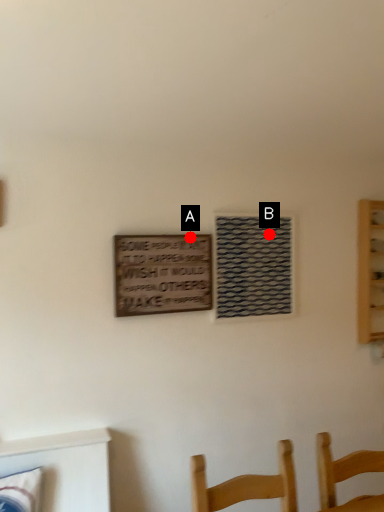
Question: Two points are circled on the image, labeled by A and B beside each circle. Which point is closer to the camera?

Choices:
 (A) A is closer
 (B) B is closer

Answer: (A)